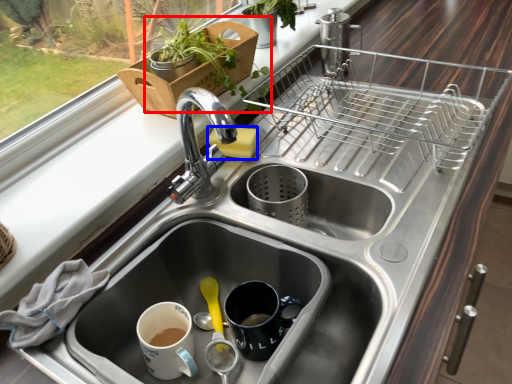
Question: Which object is further to the camera taking this photo, houseplant (highlighted by a red box) or soap (highlighted by a blue box)?

Choices:
 (A) houseplant
 (B) soap

Answer: (B)